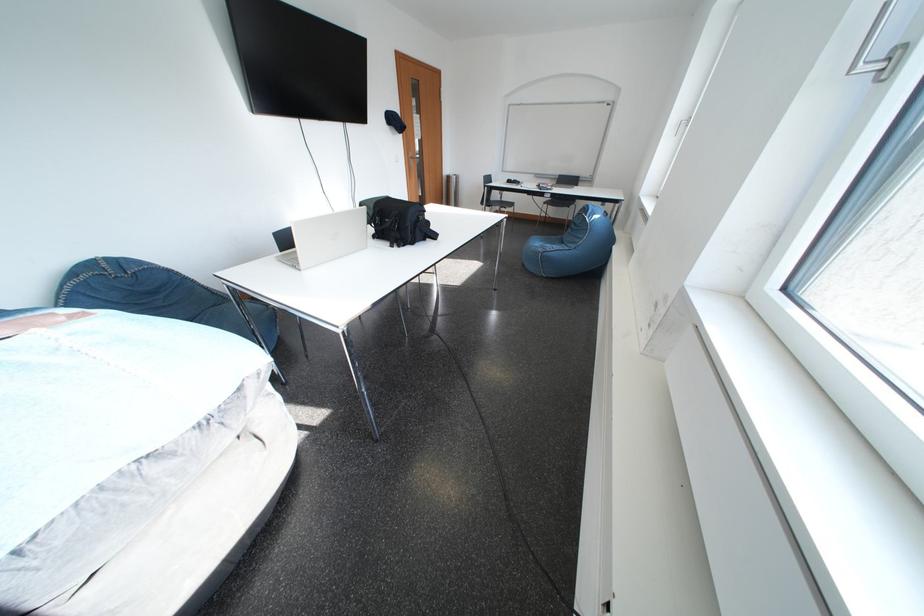
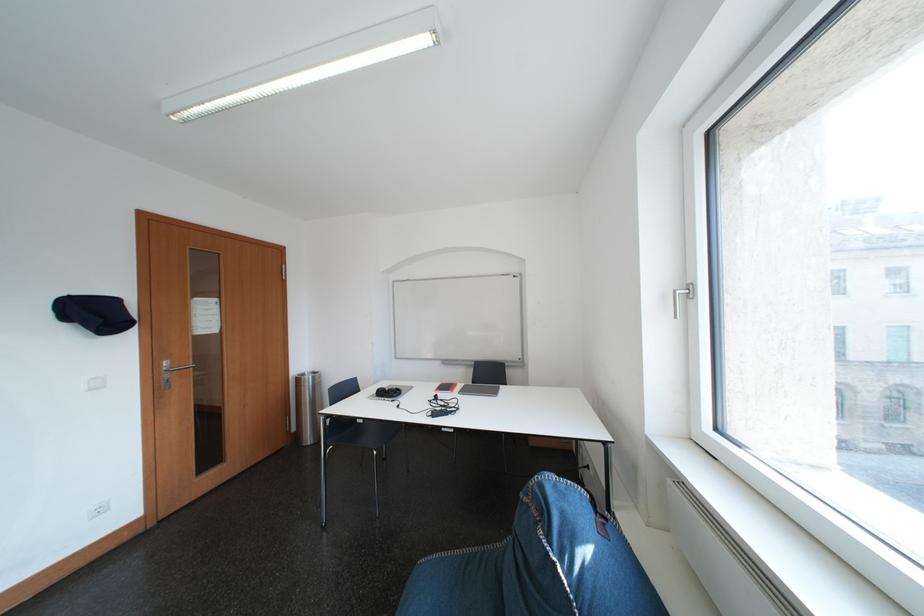
Locate, in the second image, the point that corresponds to point 459,180 in the first image.

(310, 383)